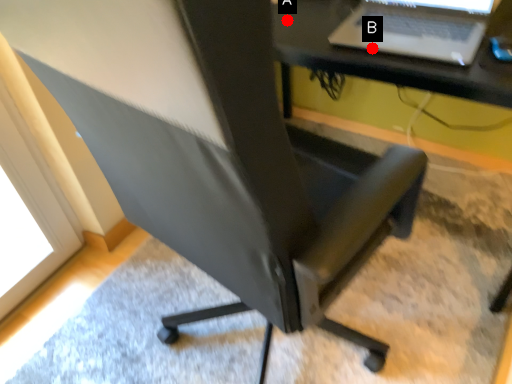
Question: Two points are circled on the image, labeled by A and B beside each circle. Which point is closer to the camera?

Choices:
 (A) A is closer
 (B) B is closer

Answer: (B)